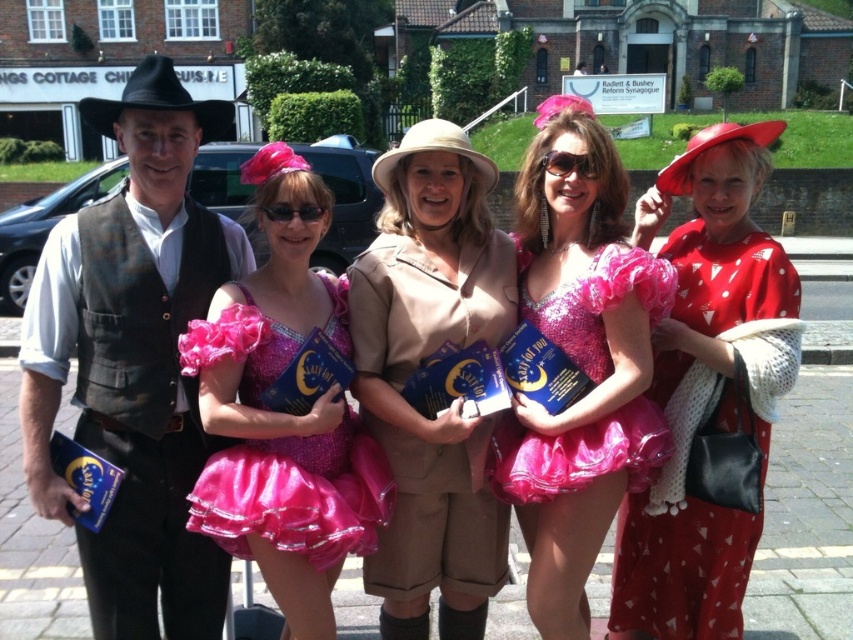
You are standing in front of the Radiett and Bosley Reform Synagogue and notice the brown leather vest at left. Can you determine its exact position in the image using coordinates?

The brown leather vest at left is located at point (134, 362).

You are standing at the center of the image. Which direction should you move to get closer to the brown leather vest at left?

Since the brown leather vest at left is located at point (134, 362), you should move to the left to get closer to it.